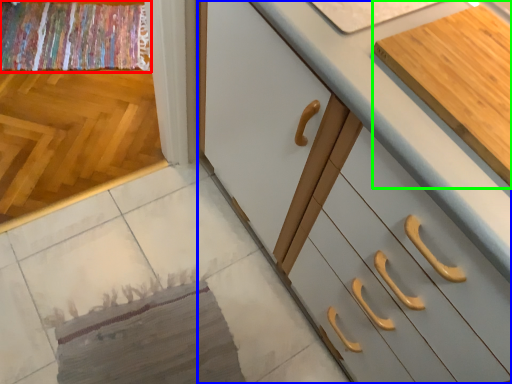
Question: Considering the real-world distances, which object is farthest from blanket (highlighted by a red box)? cabinetry (highlighted by a blue box) or cabinetry (highlighted by a green box)?

Choices:
 (A) cabinetry
 (B) cabinetry

Answer: (B)